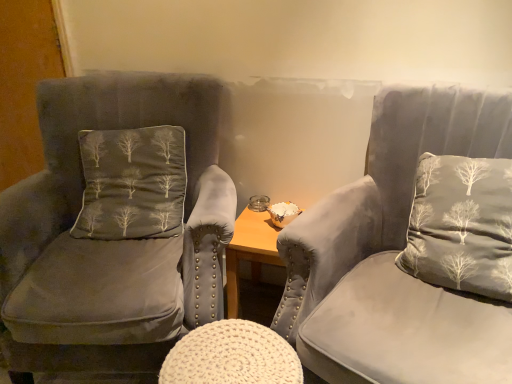
Question: From a real-world perspective, is suede gray chair at left, which is the first chair in left-to-right order, positioned over white knitted stool at center based on gravity?

Choices:
 (A) yes
 (B) no

Answer: (A)

Question: Can you confirm if suede gray chair at left, which appears as the 2th chair when viewed from the right, is smaller than white knitted stool at center?

Choices:
 (A) no
 (B) yes

Answer: (A)

Question: Is suede gray chair at left, which appears as the 2th chair when viewed from the right, wider than white knitted stool at center?

Choices:
 (A) yes
 (B) no

Answer: (A)

Question: Can you confirm if suede gray chair at left, which is the first chair in left-to-right order, is shorter than white knitted stool at center?

Choices:
 (A) yes
 (B) no

Answer: (B)

Question: From the image's perspective, is suede gray chair at left, which is the first chair in left-to-right order, under white knitted stool at center?

Choices:
 (A) no
 (B) yes

Answer: (A)

Question: Can you confirm if suede gray chair at left, which appears as the 2th chair when viewed from the right, is bigger than white knitted stool at center?

Choices:
 (A) no
 (B) yes

Answer: (B)

Question: Considering the relative sizes of gray fabric pillow at right, arranged as the 1th pillow when viewed from the right, and suede gray chair at left, which is the first chair in left-to-right order, in the image provided, is gray fabric pillow at right, arranged as the 1th pillow when viewed from the right, taller than suede gray chair at left, which is the first chair in left-to-right order,?

Choices:
 (A) no
 (B) yes

Answer: (A)

Question: From the image's perspective, is gray fabric pillow at right, arranged as the 1th pillow when viewed from the right, on top of suede gray chair at left, which appears as the 2th chair when viewed from the right?

Choices:
 (A) yes
 (B) no

Answer: (A)

Question: Is gray fabric pillow at right, which is counted as the second pillow, starting from the left, turned away from suede gray chair at left, which appears as the 2th chair when viewed from the right?

Choices:
 (A) yes
 (B) no

Answer: (B)

Question: Can you confirm if gray fabric pillow at right, arranged as the 1th pillow when viewed from the right, is smaller than suede gray chair at left, which is the first chair in left-to-right order?

Choices:
 (A) no
 (B) yes

Answer: (B)

Question: Is gray fabric pillow at right, which is counted as the second pillow, starting from the left, positioned in front of suede gray chair at left, which is the first chair in left-to-right order?

Choices:
 (A) yes
 (B) no

Answer: (B)

Question: From a real-world perspective, is gray fabric pillow at right, which is counted as the second pillow, starting from the left, positioned under suede gray chair at left, which appears as the 2th chair when viewed from the right, based on gravity?

Choices:
 (A) no
 (B) yes

Answer: (A)

Question: Considering the relative positions of dark gray velvet pillow with tree pattern at left, which ranks as the 2th pillow in right-to-left order, and gray fabric pillow at right, arranged as the 1th pillow when viewed from the right, in the image provided, is dark gray velvet pillow with tree pattern at left, which ranks as the 2th pillow in right-to-left order, to the left of gray fabric pillow at right, arranged as the 1th pillow when viewed from the right, from the viewer's perspective?

Choices:
 (A) no
 (B) yes

Answer: (B)